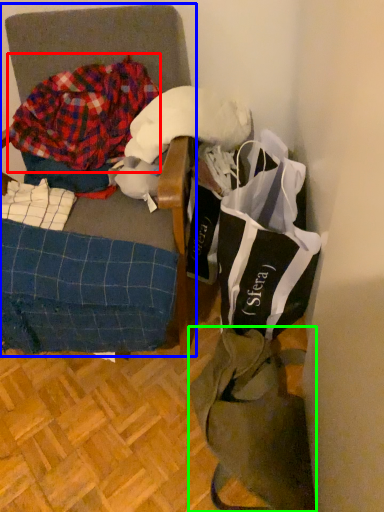
Question: Based on their relative distances, which object is nearer to flannel (highlighted by a red box)? Choose from furniture (highlighted by a blue box) and tote bag (highlighted by a green box).

Choices:
 (A) furniture
 (B) tote bag

Answer: (A)